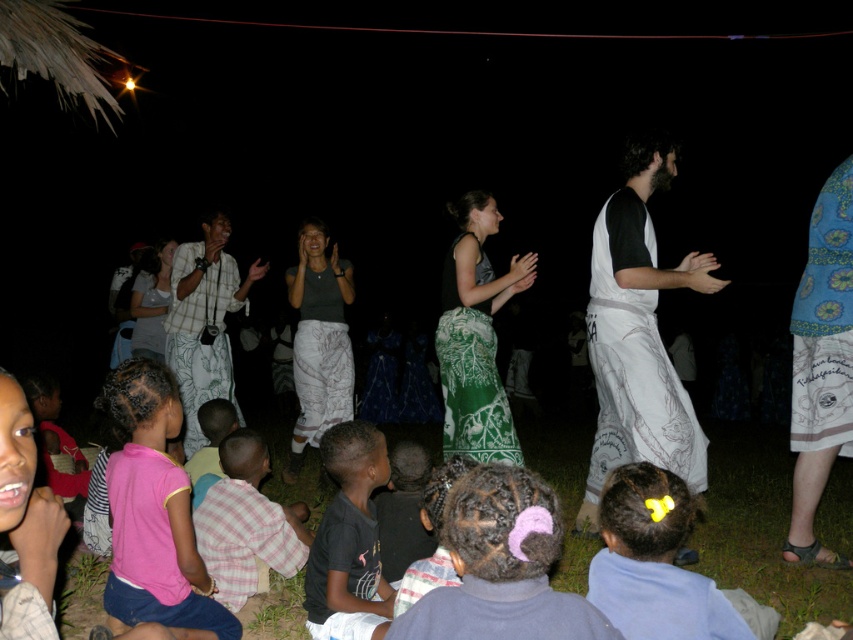
You are organizing a charity event and need to decide which clothing item to place in a donation box. The box has a capacity of 1.2 cubic feet. The white cotton skirt at right and the pink plaid shirt at lower left are candidates. Based on their sizes, which one is more likely to fit into the box?

The white cotton skirt at right has a larger size compared to the pink plaid shirt at lower left. Therefore, the pink plaid shirt at lower left is more likely to fit into the donation box with a capacity of 1.2 cubic feet since it is smaller in size.